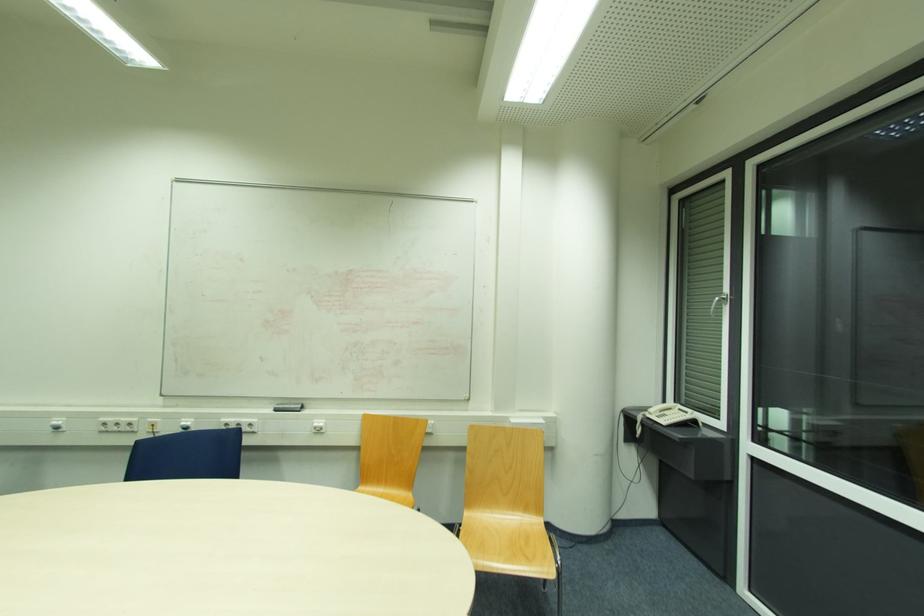
What do you see at coordinates (718, 302) in the screenshot? I see `the window handle` at bounding box center [718, 302].